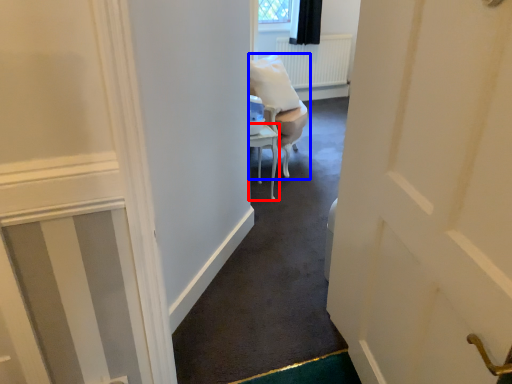
Question: Which object is closer to the camera taking this photo, furniture (highlighted by a red box) or chair (highlighted by a blue box)?

Choices:
 (A) furniture
 (B) chair

Answer: (A)